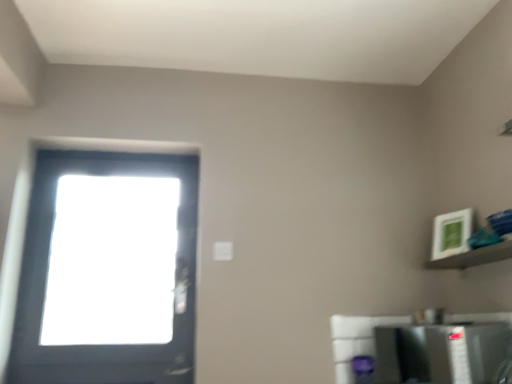
Image resolution: width=512 pixels, height=384 pixels. What do you see at coordinates (474, 257) in the screenshot? I see `white wooden shelf at upper right` at bounding box center [474, 257].

Find the location of `white wooden shelf at upper right`. white wooden shelf at upper right is located at coordinates (474, 257).

The width and height of the screenshot is (512, 384). I want to click on white wooden shelf at upper right, so click(x=474, y=257).